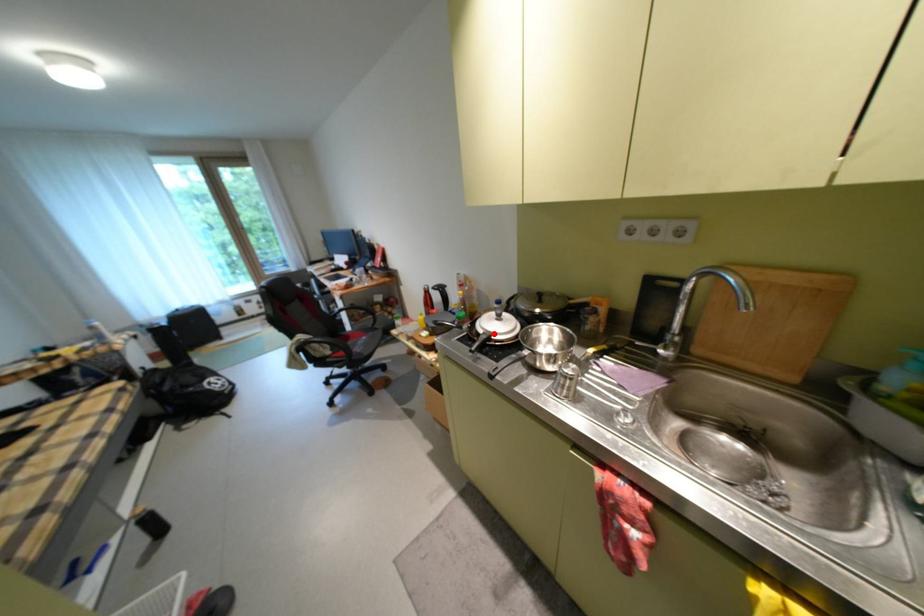
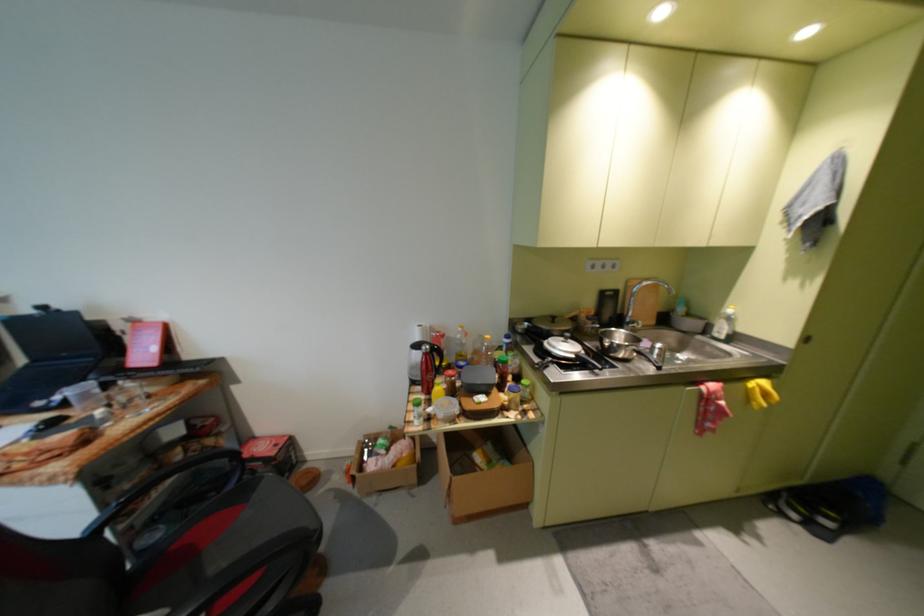
Find the pixel in the second image that matches the highlighted location in the first image.

(586, 357)